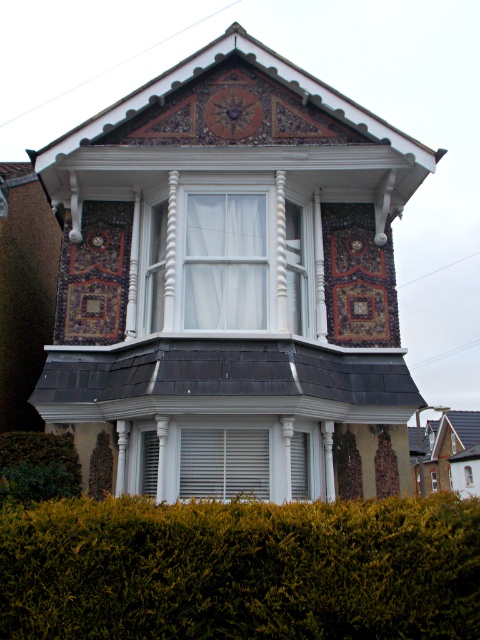
Looking at this image, is green leafy hedge at lower center below clear glass window at center?

No, green leafy hedge at lower center is not below clear glass window at center.

Who is shorter, green leafy hedge at lower center or clear glass window at center?

Standing shorter between the two is clear glass window at center.

Find the location of a particular element. The height and width of the screenshot is (640, 480). green leafy hedge at lower center is located at coordinates (240, 570).

Consider the image. Is white wood bay window at center positioned behind green leafy hedge at lower left?

Yes, it is behind green leafy hedge at lower left.

Where is `white wood bay window at center`? white wood bay window at center is located at coordinates (227, 259).

Locate an element on the screen. Image resolution: width=480 pixels, height=640 pixels. white wood bay window at center is located at coordinates (227, 259).

Is white wood bay window at center further to the viewer compared to white matte window at center?

Yes.

Who is more forward, (149, 307) or (163, 496)?

Positioned in front is point (163, 496).

Between point (280, 296) and point (222, 452), which one is positioned behind?

The point (280, 296) is more distant.

Identify the location of white wood bay window at center. Image resolution: width=480 pixels, height=640 pixels. (227, 259).